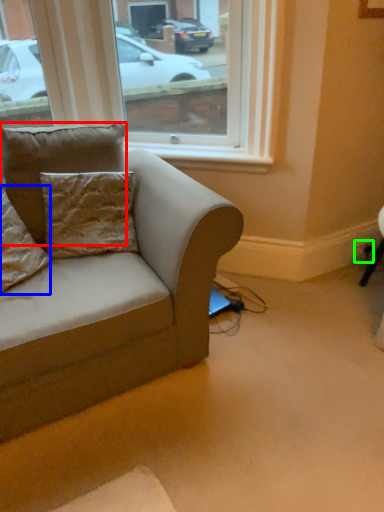
Question: Which is nearer to the pillow (highlighted by a red box)? pillow (highlighted by a blue box) or electric outlet (highlighted by a green box).

Choices:
 (A) pillow
 (B) electric outlet

Answer: (A)